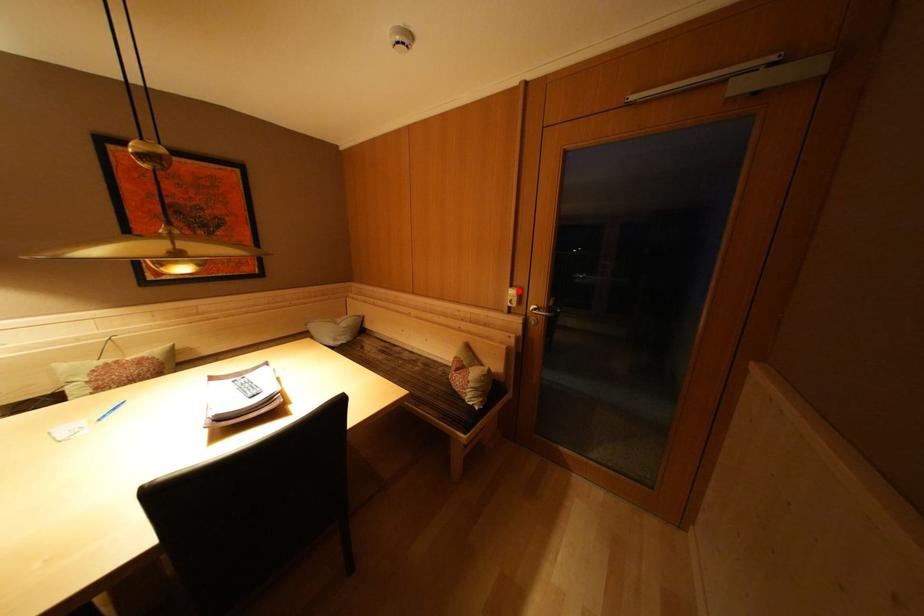
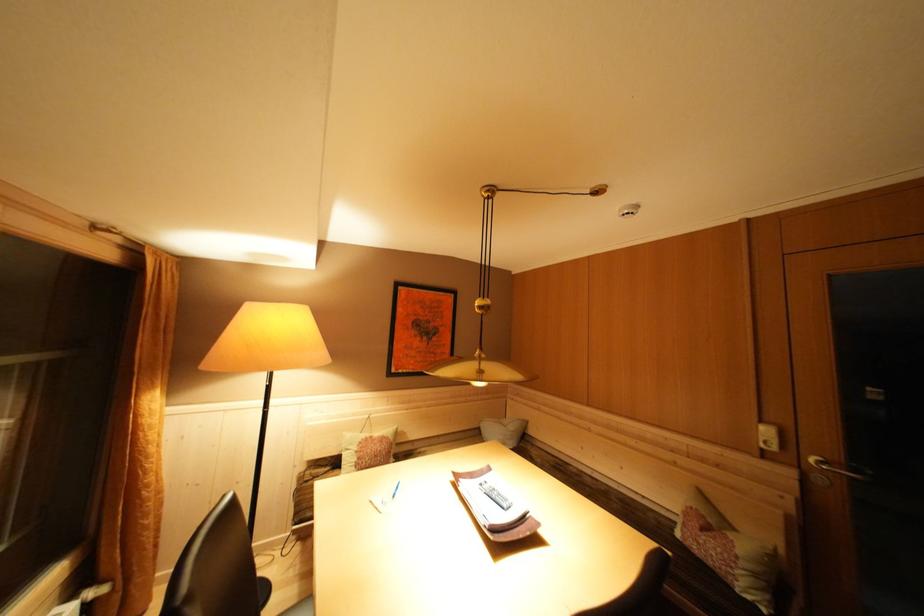
Where in the second image is the point corresponding to the highlighted location from the first image?

(768, 427)